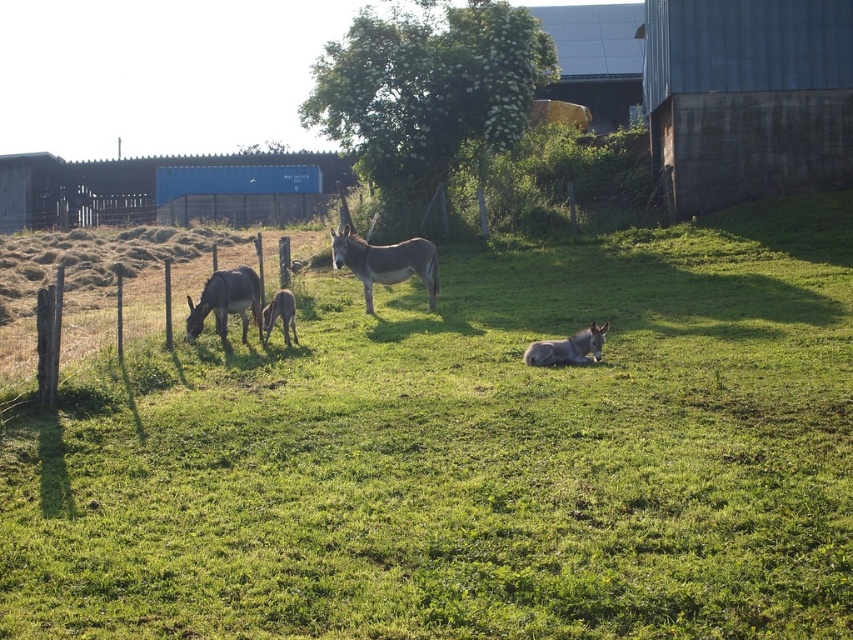
Question: Is gray matte mule at lower left smaller than gray matte mule at lower center?

Choices:
 (A) yes
 (B) no

Answer: (B)

Question: Which object is closer to the camera taking this photo?

Choices:
 (A) gray matte donkey at center
 (B) gray matte mule at lower center
 (C) gray matte mule at center
 (D) gray matte mule at lower left

Answer: (B)

Question: Is gray matte mule at lower left thinner than gray matte mule at lower center?

Choices:
 (A) yes
 (B) no

Answer: (A)

Question: Which point is closer to the camera taking this photo?

Choices:
 (A) (368, 296)
 (B) (590, 339)
 (C) (216, 284)

Answer: (B)

Question: Can you confirm if green grassy at center is smaller than gray matte mule at lower center?

Choices:
 (A) yes
 (B) no

Answer: (B)

Question: Which object is farther from the camera taking this photo?

Choices:
 (A) gray matte mule at lower center
 (B) gray matte donkey at center
 (C) gray matte mule at lower left

Answer: (B)